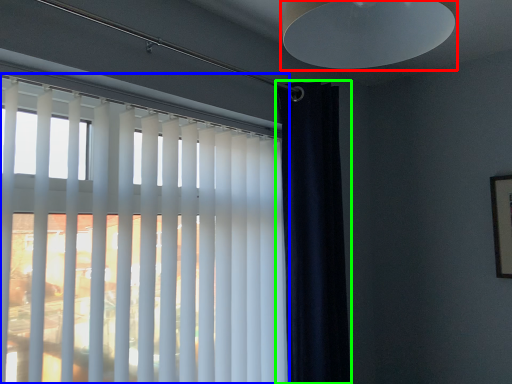
Question: Which is farther away from lamp (highlighted by a red box)? window blind (highlighted by a blue box) or curtain (highlighted by a green box)?

Choices:
 (A) window blind
 (B) curtain

Answer: (B)